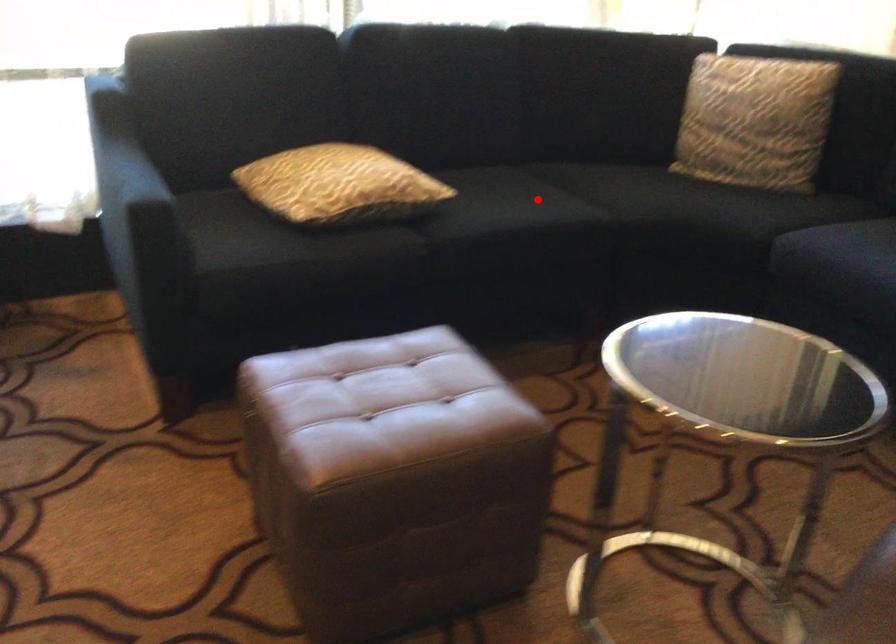
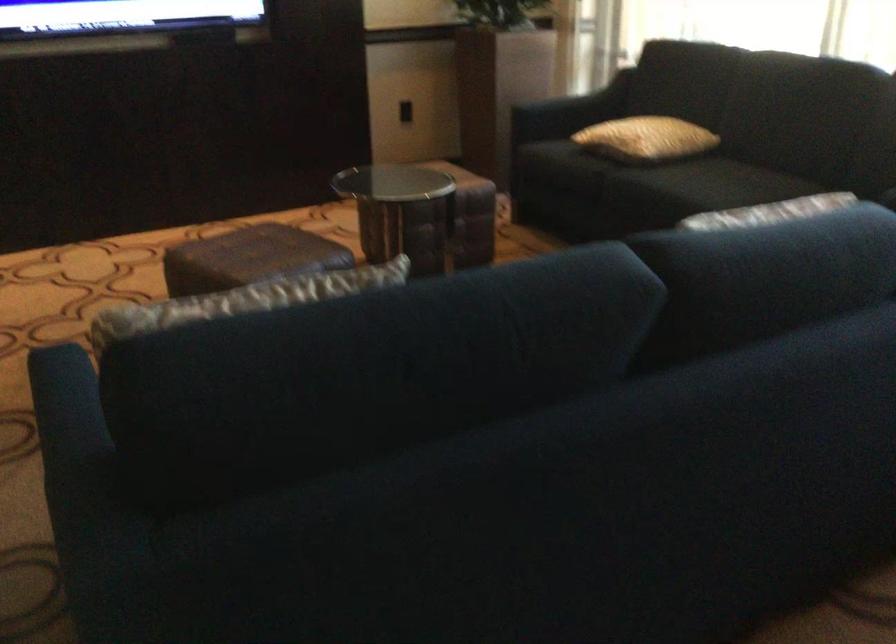
Question: I am providing you with two images of the same scene from different viewpoints. In image1, a red point is highlighted. Considering the same 3D point in image2, which of the following is correct?

Choices:
 (A) It is closer
 (B) It is farther

Answer: (B)